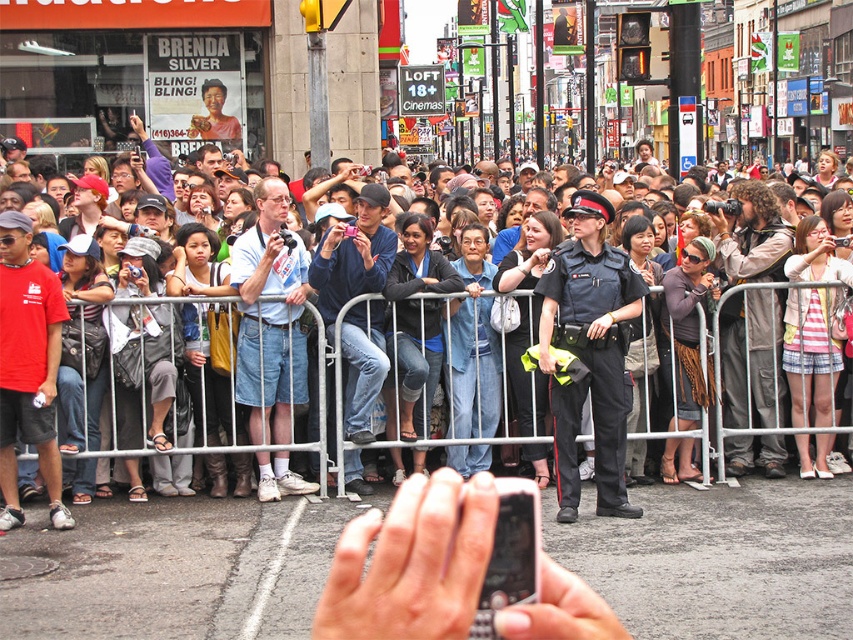
You are a photographer standing at the edge of the crowd, aiming to capture the striped fabric skirt at center. Based on the scene description, where in the image would you position your camera to ensure the skirt is in the frame?

The striped fabric skirt at center is located at point (810, 355), so you should position your camera to focus on that coordinate to include the skirt in the frame.

You are a photographer trying to capture both the striped fabric skirt at center and the matte black uniform at center in the same frame. Which object should you focus on first to ensure both are in the frame?

The striped fabric skirt at center has a larger width than the matte black uniform at center, so you should focus on the striped fabric skirt at center first to ensure both are in the frame.

You are standing at the center of the image and see a point at coordinates point (810,355). What is this point located on?

The point (810,355) is located on the striped fabric skirt at center.